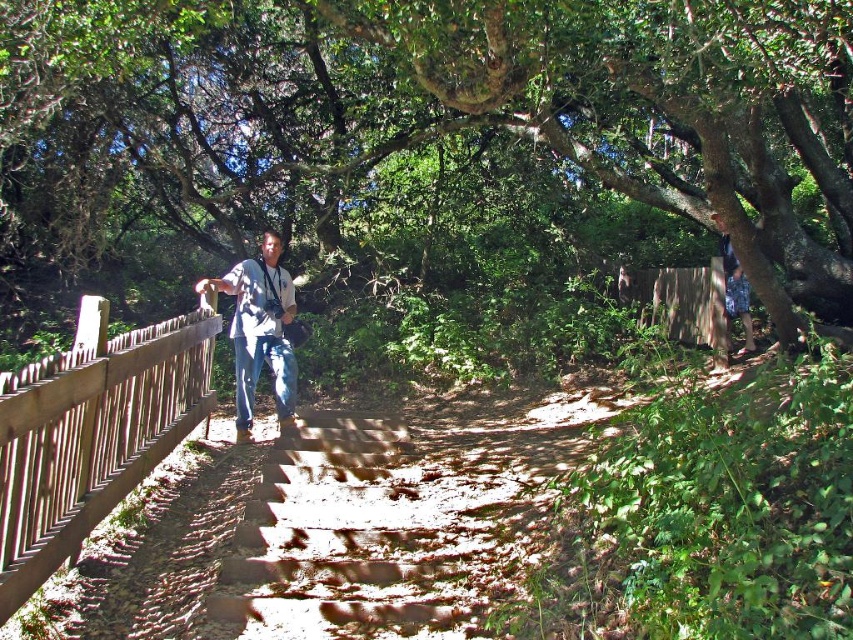
You are standing at the bottom of the wooden staircase in the forest. You see the brown wooden fence at left and the blue jeans at center. Which object is nearer to you?

The brown wooden fence at left is closer to the viewer than the blue jeans at center, so the brown wooden fence at left is nearer to you.

You are standing at the base of the wooden staircase in the forest. There are two points marked in the scene, point (361, 10) and point (276, 304). Which point is nearer to you as you face the staircase?

Point (361, 10) is closer to the viewer than point (276, 304), so the point (361, 10) is nearer to you as you face the staircase.